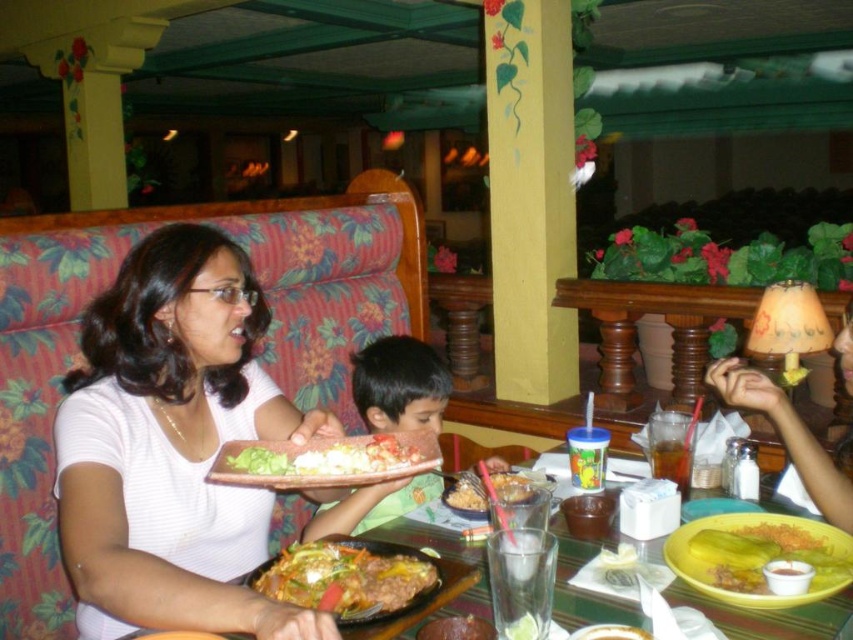
Does shiny plastic tray at center come in front of slightly browned rice at center?

That is True.

Which is more to the right, shiny plastic tray at center or slightly browned rice at center?

slightly browned rice at center is more to the right.

Locate an element on the screen. shiny plastic tray at center is located at coordinates (328, 458).

I want to click on shiny plastic tray at center, so click(x=328, y=458).

Can you confirm if brown hair boy at center is smaller than meat and vegetable stir-fry at center?

Incorrect, brown hair boy at center is not smaller in size than meat and vegetable stir-fry at center.

Which is more to the right, brown hair boy at center or meat and vegetable stir-fry at center?

From the viewer's perspective, brown hair boy at center appears more on the right side.

Is point (386, 420) positioned before point (376, 570)?

No.

In order to click on brown hair boy at center in this screenshot , I will do `click(399, 385)`.

Who is higher up, brown hair boy at center or shiny brown meat at center?

brown hair boy at center is higher up.

Describe the element at coordinates (399, 385) in the screenshot. Image resolution: width=853 pixels, height=640 pixels. I see `brown hair boy at center` at that location.

Find the location of `brown hair boy at center`. brown hair boy at center is located at coordinates (399, 385).